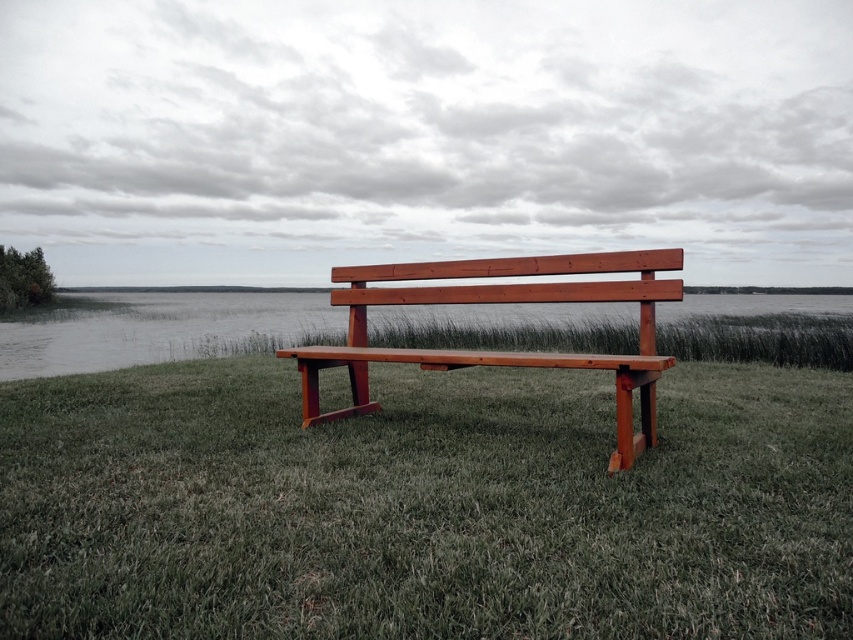
Question: Can you confirm if green grass at center is positioned to the left of wooden bench at center?

Choices:
 (A) no
 (B) yes

Answer: (B)

Question: Which of the following is the farthest from the observer?

Choices:
 (A) green grass at center
 (B) wooden bench at center

Answer: (B)

Question: Among these points, which one is nearest to the camera?

Choices:
 (A) (708, 554)
 (B) (332, 291)

Answer: (A)

Question: Does green grass at center have a greater width compared to wooden bench at center?

Choices:
 (A) yes
 (B) no

Answer: (B)

Question: Which object appears farthest from the camera in this image?

Choices:
 (A) green grass at center
 (B) wooden bench at center

Answer: (B)

Question: Where is green grass at center located in relation to wooden bench at center in the image?

Choices:
 (A) above
 (B) below

Answer: (B)